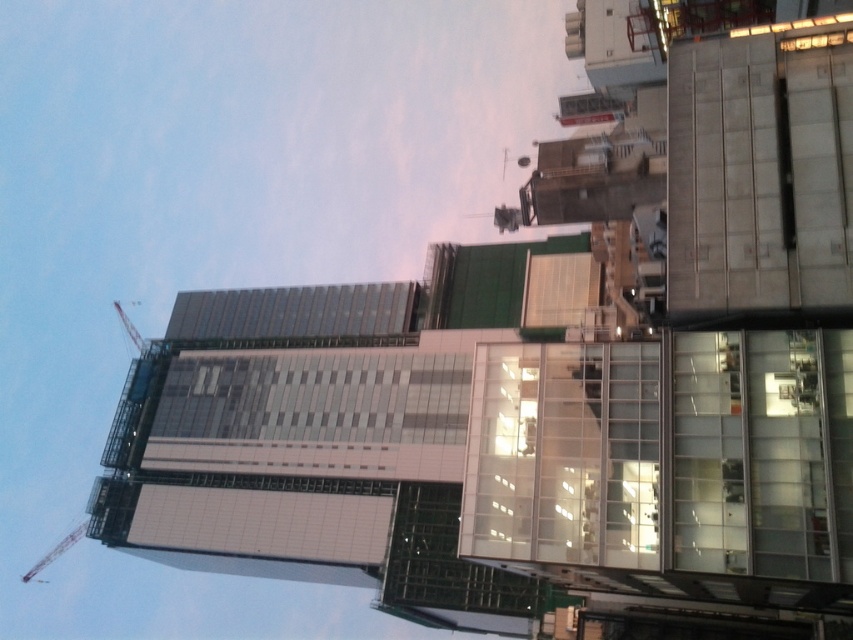
Question: Which object appears closest to the camera in this image?

Choices:
 (A) metallic red crane at left
 (B) metallic construction crane at upper left

Answer: (A)

Question: Is metallic red crane at left above metallic construction crane at upper left?

Choices:
 (A) no
 (B) yes

Answer: (A)

Question: Does metallic red crane at left have a larger size compared to metallic construction crane at upper left?

Choices:
 (A) no
 (B) yes

Answer: (B)

Question: Among these objects, which one is nearest to the camera?

Choices:
 (A) metallic red crane at left
 (B) metallic construction crane at upper left

Answer: (A)

Question: Does metallic red crane at left appear under metallic construction crane at upper left?

Choices:
 (A) no
 (B) yes

Answer: (B)

Question: Which object is closer to the camera taking this photo?

Choices:
 (A) metallic construction crane at upper left
 (B) metallic red crane at left

Answer: (B)